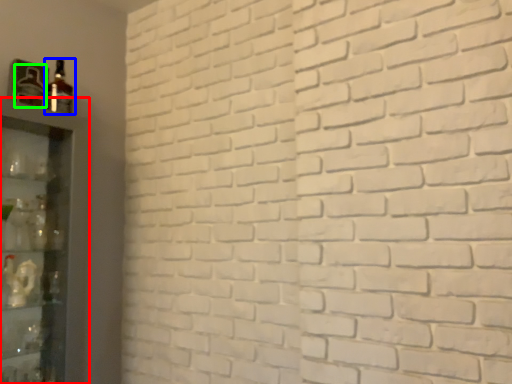
Question: Which object is positioned farthest from shelf (highlighted by a red box)? Select from bottle (highlighted by a blue box) and bottle (highlighted by a green box).

Choices:
 (A) bottle
 (B) bottle

Answer: (A)